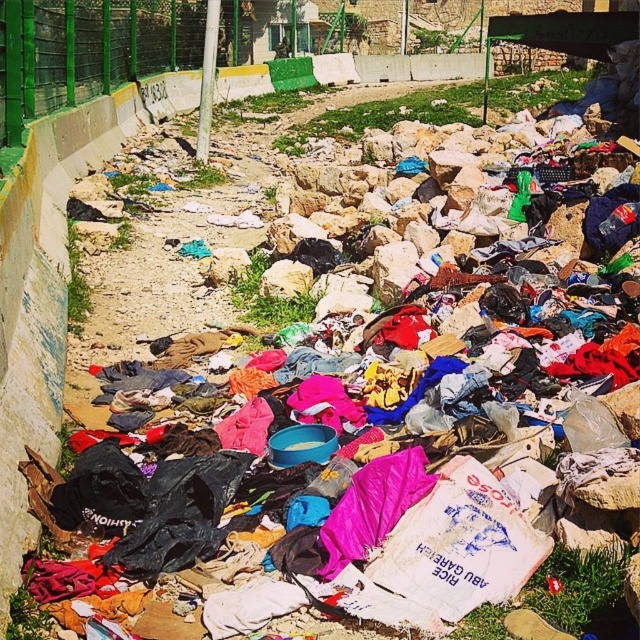
Measure the distance between green metal fence at upper center and green grass at upper center.

green metal fence at upper center and green grass at upper center are 42.26 feet apart.

Where is `green metal fence at upper center`? The image size is (640, 640). green metal fence at upper center is located at coordinates (88, 51).